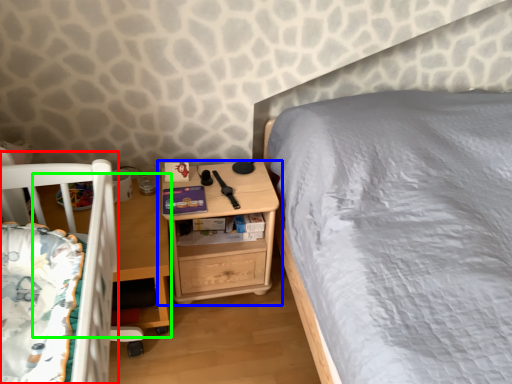
Question: Which is nearer to the infant bed (highlighted by a red box)? nightstand (highlighted by a blue box) or table (highlighted by a green box).

Choices:
 (A) nightstand
 (B) table

Answer: (B)